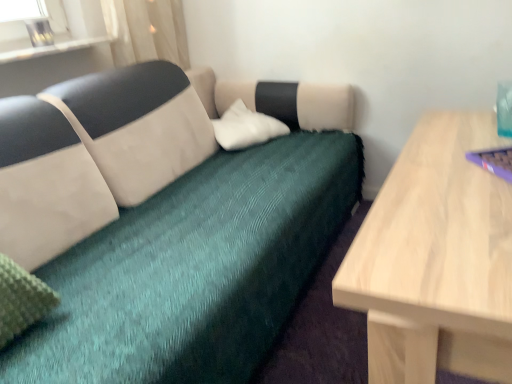
Question: From a real-world perspective, is teal fabric couch at center positioned above or below purple plastic laptop at right?

Choices:
 (A) below
 (B) above

Answer: (A)

Question: In the image, is teal fabric couch at center positioned in front of or behind purple plastic laptop at right?

Choices:
 (A) behind
 (B) front

Answer: (B)

Question: Which object is the closest to the purple plastic laptop at right?

Choices:
 (A) clear glass vase at upper left
 (B) white soft pillow at center
 (C) teal fabric couch at center
 (D) sheer white curtain at upper left

Answer: (C)

Question: Which is farther from the sheer white curtain at upper left?

Choices:
 (A) teal fabric couch at center
 (B) purple plastic laptop at right
 (C) clear glass vase at upper left
 (D) white soft pillow at center

Answer: (B)